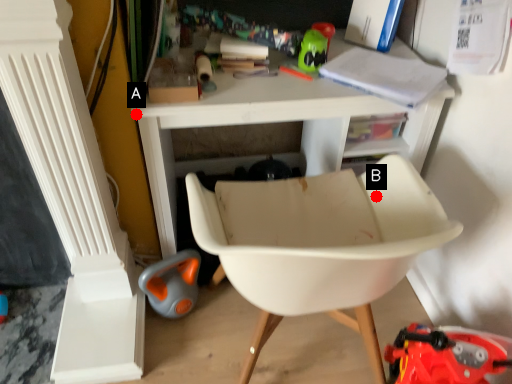
Question: Two points are circled on the image, labeled by A and B beside each circle. Which point is closer to the camera?

Choices:
 (A) A is closer
 (B) B is closer

Answer: (A)